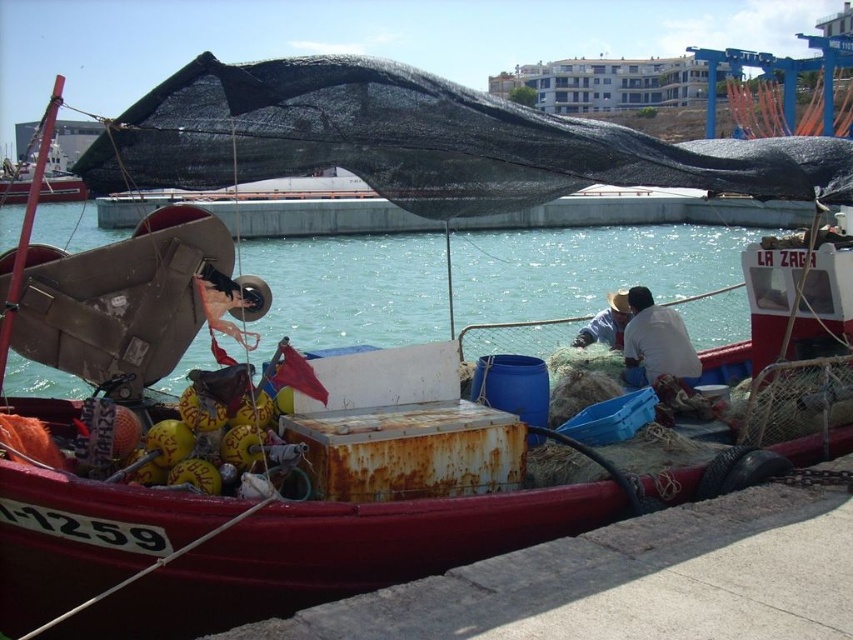
Does point (721, 228) come in front of point (646, 333)?

No.

Does clear blue water at center have a lesser width compared to white matte shirt at center?

In fact, clear blue water at center might be wider than white matte shirt at center.

The height and width of the screenshot is (640, 853). What are the coordinates of `clear blue water at center` in the screenshot? It's located at (587, 268).

In order to click on clear blue water at center in this screenshot , I will do `click(587, 268)`.

Consider the image. Does white matte shirt at center appear under white straw hat at center?

Indeed, white matte shirt at center is positioned under white straw hat at center.

Does point (688, 381) lie in front of point (618, 292)?

Yes, it is in front of point (618, 292).

Is point (686, 376) positioned in front of point (602, 328)?

Yes, it is.

In order to click on white matte shirt at center in this screenshot , I will do `click(656, 342)`.

Consider the image. Does clear blue water at center have a smaller size compared to white straw hat at center?

No.

Between clear blue water at center and white straw hat at center, which one appears on the right side from the viewer's perspective?

white straw hat at center is more to the right.

Describe the element at coordinates (587, 268) in the screenshot. The width and height of the screenshot is (853, 640). I see `clear blue water at center` at that location.

Identify the location of clear blue water at center. The image size is (853, 640). [x=587, y=268].